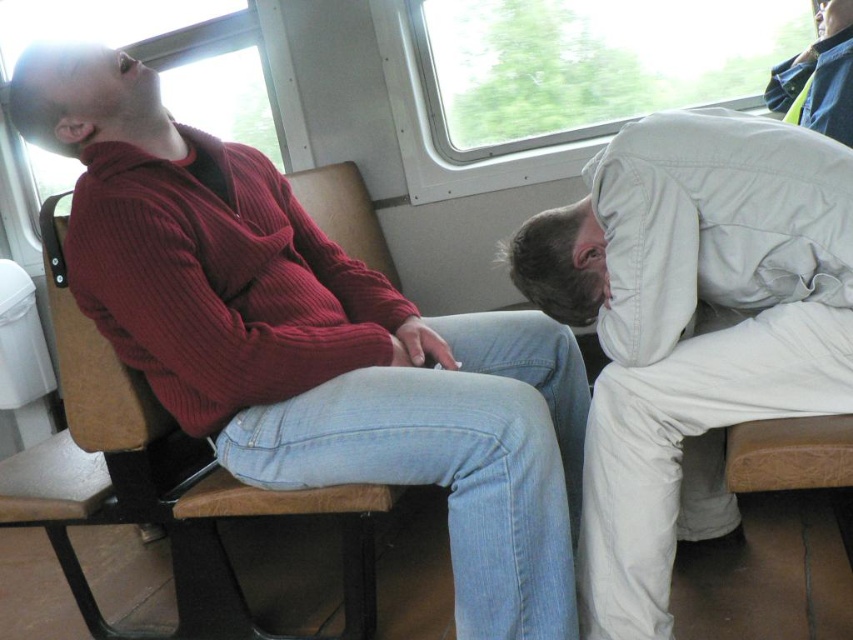
Question: Can you confirm if ribbed sweater at center is wider than light beige cotton pants at right?

Choices:
 (A) no
 (B) yes

Answer: (B)

Question: Which point is farther to the camera?

Choices:
 (A) light beige cotton pants at right
 (B) ribbed sweater at center

Answer: (B)

Question: In this image, where is ribbed sweater at center located relative to light beige cotton pants at right?

Choices:
 (A) right
 (B) left

Answer: (B)

Question: Is ribbed sweater at center smaller than light beige cotton pants at right?

Choices:
 (A) yes
 (B) no

Answer: (B)